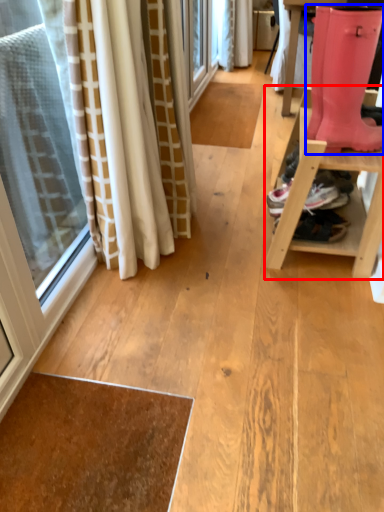
Question: Among these objects, which one is nearest to the camera, furniture (highlighted by a red box) or footwear (highlighted by a blue box)?

Choices:
 (A) furniture
 (B) footwear

Answer: (B)